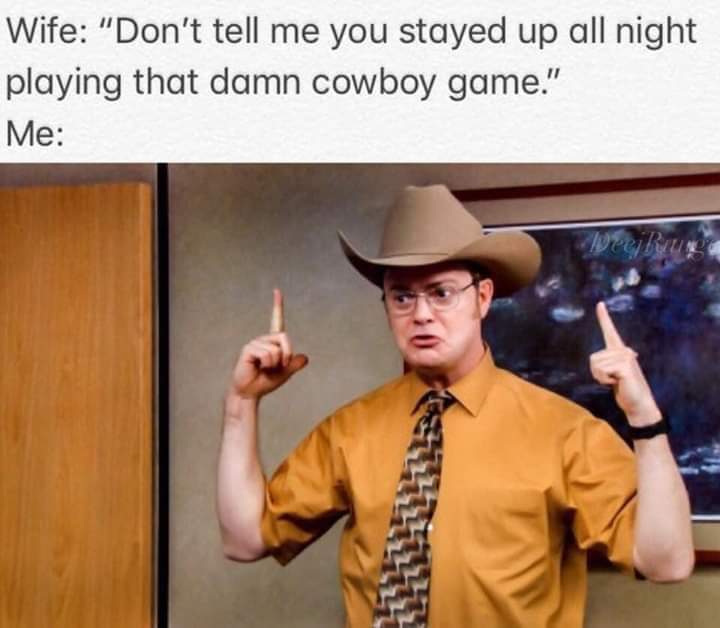
What are the coordinates of `mat around picture in frame` in the screenshot? It's located at (626, 205).